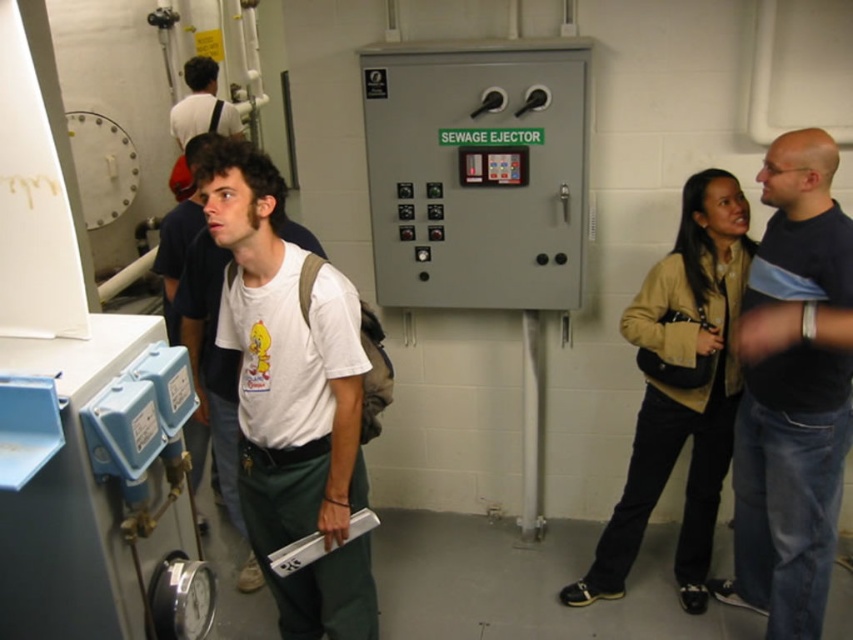
Question: In this image, where is tan leather jacket at center right located relative to white matte shirt at upper left?

Choices:
 (A) below
 (B) above

Answer: (A)

Question: From the image, what is the correct spatial relationship of white cotton t-shirt at center in relation to tan leather jacket at center right?

Choices:
 (A) below
 (B) above

Answer: (B)

Question: Considering the real-world distances, which object is closest to the white cotton t-shirt at center?

Choices:
 (A) silver metallic tray at center
 (B) white matte shirt at upper left
 (C) tan leather jacket at center right

Answer: (A)

Question: From the image, what is the correct spatial relationship of white cotton t-shirt at center in relation to dark blue t-shirt at upper right?

Choices:
 (A) above
 (B) below

Answer: (A)

Question: Which object is positioned closest to the white matte shirt at upper left?

Choices:
 (A) silver metallic tray at center
 (B) dark blue t-shirt at upper right
 (C) white cotton t-shirt at center

Answer: (C)

Question: Which of the following is the closest to the observer?

Choices:
 (A) (305, 540)
 (B) (287, 602)
 (C) (183, 76)
 (D) (664, 330)

Answer: (A)